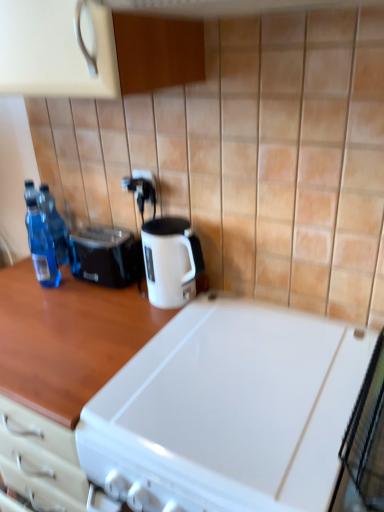
Measure the distance between white glossy electric kettle at center and camera.

A distance of 1.13 meters exists between white glossy electric kettle at center and camera.

The width and height of the screenshot is (384, 512). What do you see at coordinates (55, 225) in the screenshot? I see `transparent plastic bottles at left, marked as the second bottle in a front-to-back arrangement` at bounding box center [55, 225].

Measure the distance between point (51, 264) and camera.

Point (51, 264) and camera are 4.38 feet apart.

The height and width of the screenshot is (512, 384). Describe the element at coordinates (41, 244) in the screenshot. I see `transparent plastic bottles at left, which is the first bottle from front to back` at that location.

How much space does woodenmaterial/texturecountertop at center, marked as the first countertop in a left-to-right arrangement, occupy vertically?

woodenmaterial/texturecountertop at center, marked as the first countertop in a left-to-right arrangement, is 34.20 inches in height.

What is the approximate width of black plastic toaster at left?

black plastic toaster at left is 6.89 inches in width.

Where is `black plastic toaster at left`? black plastic toaster at left is located at coordinates (105, 256).

Where is `white glossy electric kettle at center`? The image size is (384, 512). white glossy electric kettle at center is located at coordinates coord(166,249).

Is transparent plastic bottles at left, marked as the second bottle in a front-to-back arrangement, looking in the opposite direction of white plastic electric outlet at center, the first electric outlet ordered from the bottom?

No, transparent plastic bottles at left, marked as the second bottle in a front-to-back arrangement, is not facing away from white plastic electric outlet at center, the first electric outlet ordered from the bottom.

From a real-world perspective, who is located higher, transparent plastic bottles at left, arranged as the first bottle when viewed from the back, or white plastic electric outlet at center, positioned as the 2th electric outlet in top-to-bottom order?

white plastic electric outlet at center, positioned as the 2th electric outlet in top-to-bottom order, from a real-world perspective.

How distant is transparent plastic bottles at left, marked as the second bottle in a front-to-back arrangement, from white plastic electric outlet at center, positioned as the 2th electric outlet in top-to-bottom order?

A distance of 29.43 centimeters exists between transparent plastic bottles at left, marked as the second bottle in a front-to-back arrangement, and white plastic electric outlet at center, positioned as the 2th electric outlet in top-to-bottom order.

Considering the relative sizes of white plastic electric outlet at center, positioned as the 2th electric outlet in top-to-bottom order, and woodenmaterial/texturecountertop at center, arranged as the 2th countertop when viewed from the right, in the image provided, is white plastic electric outlet at center, positioned as the 2th electric outlet in top-to-bottom order, taller than woodenmaterial/texturecountertop at center, arranged as the 2th countertop when viewed from the right,?

No, white plastic electric outlet at center, positioned as the 2th electric outlet in top-to-bottom order, is not taller than woodenmaterial/texturecountertop at center, arranged as the 2th countertop when viewed from the right.

Can you tell me how much white plastic electric outlet at center, the first electric outlet ordered from the bottom, and woodenmaterial/texturecountertop at center, marked as the first countertop in a left-to-right arrangement, differ in facing direction?

The facing directions of white plastic electric outlet at center, the first electric outlet ordered from the bottom, and woodenmaterial/texturecountertop at center, marked as the first countertop in a left-to-right arrangement, are 0.463 degrees apart.

In the scene shown: In terms of width, does white plastic electric outlet at center, the first electric outlet ordered from the bottom, look wider or thinner when compared to woodenmaterial/texturecountertop at center, arranged as the 2th countertop when viewed from the right?

Considering their sizes, white plastic electric outlet at center, the first electric outlet ordered from the bottom, looks slimmer than woodenmaterial/texturecountertop at center, arranged as the 2th countertop when viewed from the right.

From the image's perspective, is black plastic electric outlet at upper center, which ranks as the 2th electric outlet in bottom-to-top order, positioned above or below white plastic electric outlet at center, the first electric outlet ordered from the bottom?

black plastic electric outlet at upper center, which ranks as the 2th electric outlet in bottom-to-top order, is above white plastic electric outlet at center, the first electric outlet ordered from the bottom.

Would you say black plastic electric outlet at upper center, which ranks as the 2th electric outlet in bottom-to-top order, is to the left or to the right of white plastic electric outlet at center, the first electric outlet ordered from the bottom, in the picture?

From the image, it's evident that black plastic electric outlet at upper center, which ranks as the 2th electric outlet in bottom-to-top order, is to the right of white plastic electric outlet at center, the first electric outlet ordered from the bottom.

Is black plastic electric outlet at upper center, arranged as the first electric outlet when viewed from the top, outside of white plastic electric outlet at center, positioned as the 2th electric outlet in top-to-bottom order?

Indeed, black plastic electric outlet at upper center, arranged as the first electric outlet when viewed from the top, is completely outside white plastic electric outlet at center, positioned as the 2th electric outlet in top-to-bottom order.

Considering the relative sizes of black plastic toaster at left and white glossy electric kettle at center in the image provided, is black plastic toaster at left taller than white glossy electric kettle at center?

No, black plastic toaster at left is not taller than white glossy electric kettle at center.

From a real-world perspective, is black plastic toaster at left physically located above or below white glossy electric kettle at center?

In terms of real-world spatial position, black plastic toaster at left is below white glossy electric kettle at center.

In the scene shown: Considering the positions of objects black plastic toaster at left and white glossy electric kettle at center in the image provided, who is in front, black plastic toaster at left or white glossy electric kettle at center?

white glossy electric kettle at center is closer to the camera.

Is transparent plastic bottles at left, marked as the second bottle in a front-to-back arrangement, closer to camera compared to white glossy electric kettle at center?

No, transparent plastic bottles at left, marked as the second bottle in a front-to-back arrangement, is behind white glossy electric kettle at center.

Is transparent plastic bottles at left, arranged as the first bottle when viewed from the back, positioned with its back to white glossy electric kettle at center?

transparent plastic bottles at left, arranged as the first bottle when viewed from the back, is not turned away from white glossy electric kettle at center.

Is white glossy electric kettle at center inside transparent plastic bottles at left, arranged as the first bottle when viewed from the back?

No, white glossy electric kettle at center is not a part of transparent plastic bottles at left, arranged as the first bottle when viewed from the back.

Based on the photo, who is more distant, white glossy countertop at upper left, marked as the second countertop in a left-to-right arrangement, or woodenmaterial/texturecountertop at center, marked as the first countertop in a left-to-right arrangement?

woodenmaterial/texturecountertop at center, marked as the first countertop in a left-to-right arrangement, is more distant.

Identify the location of countertop in front of the woodenmaterial/texturecountertop at center, arranged as the 2th countertop when viewed from the right. (172, 400).

Does white glossy countertop at upper left, marked as the second countertop in a left-to-right arrangement, have a smaller size compared to woodenmaterial/texturecountertop at center, marked as the first countertop in a left-to-right arrangement?

Yes.

Based on the photo, which object is closer to the camera taking this photo, woodenmaterial/texturecountertop at center, marked as the first countertop in a left-to-right arrangement, or black plastic electric outlet at upper center, arranged as the first electric outlet when viewed from the top?

woodenmaterial/texturecountertop at center, marked as the first countertop in a left-to-right arrangement, is closer to the camera.

Does woodenmaterial/texturecountertop at center, marked as the first countertop in a left-to-right arrangement, have a lesser height compared to black plastic electric outlet at upper center, arranged as the first electric outlet when viewed from the top?

No, woodenmaterial/texturecountertop at center, marked as the first countertop in a left-to-right arrangement, is not shorter than black plastic electric outlet at upper center, arranged as the first electric outlet when viewed from the top.

From the image's perspective, is woodenmaterial/texturecountertop at center, arranged as the 2th countertop when viewed from the right, located above black plastic electric outlet at upper center, arranged as the first electric outlet when viewed from the top?

No.

Would you consider woodenmaterial/texturecountertop at center, arranged as the 2th countertop when viewed from the right, to be distant from black plastic electric outlet at upper center, which ranks as the 2th electric outlet in bottom-to-top order?

They are positioned close to each other.

From a real-world perspective, which bottle is the 2nd one underneath the white plastic electric outlet at center, positioned as the 2th electric outlet in top-to-bottom order? Please provide its 2D coordinates.

[(55, 225)]

From the image's perspective, starting from the woodenmaterial/texturecountertop at center, arranged as the 2th countertop when viewed from the right, which electric outlet is the 1st one above? Please provide its 2D coordinates.

[(140, 190)]

Which object lies nearer to the anchor point black plastic electric outlet at upper center, arranged as the first electric outlet when viewed from the top, woodenmaterial/texturecountertop at center, marked as the first countertop in a left-to-right arrangement, or white glossy countertop at upper left, arranged as the first countertop when viewed from the right?

woodenmaterial/texturecountertop at center, marked as the first countertop in a left-to-right arrangement, lies closer to black plastic electric outlet at upper center, arranged as the first electric outlet when viewed from the top, than the other object.

Consider the image. Which object lies nearer to the anchor point black plastic toaster at left, white plastic electric outlet at center, the first electric outlet ordered from the bottom, or woodenmaterial/texturecountertop at center, arranged as the 2th countertop when viewed from the right?

woodenmaterial/texturecountertop at center, arranged as the 2th countertop when viewed from the right.

Estimate the real-world distances between objects in this image. Which object is closer to black plastic electric outlet at upper center, which ranks as the 2th electric outlet in bottom-to-top order, transparent plastic bottles at left, positioned as the second bottle in back-to-front order, or white glossy countertop at upper left, arranged as the first countertop when viewed from the right?

transparent plastic bottles at left, positioned as the second bottle in back-to-front order.

Estimate the real-world distances between objects in this image. Which object is further from white glossy electric kettle at center, white glossy countertop at upper left, marked as the second countertop in a left-to-right arrangement, or black plastic toaster at left?

white glossy countertop at upper left, marked as the second countertop in a left-to-right arrangement, lies further to white glossy electric kettle at center than the other object.

Estimate the real-world distances between objects in this image. Which object is closer to black plastic toaster at left, transparent plastic bottles at left, arranged as the first bottle when viewed from the back, or transparent plastic bottles at left, which is the first bottle from front to back?

The object closer to black plastic toaster at left is transparent plastic bottles at left, which is the first bottle from front to back.

Based on their spatial positions, is white glossy countertop at upper left, marked as the second countertop in a left-to-right arrangement, or white glossy electric kettle at center further from transparent plastic bottles at left, which is the first bottle from front to back?

white glossy countertop at upper left, marked as the second countertop in a left-to-right arrangement, lies further to transparent plastic bottles at left, which is the first bottle from front to back, than the other object.

Considering their positions, is black plastic electric outlet at upper center, arranged as the first electric outlet when viewed from the top, positioned closer to woodenmaterial/texturecountertop at center, arranged as the 2th countertop when viewed from the right, than black plastic toaster at left?

black plastic toaster at left is closer to woodenmaterial/texturecountertop at center, arranged as the 2th countertop when viewed from the right.

Based on their spatial positions, is transparent plastic bottles at left, positioned as the second bottle in back-to-front order, or white plastic electric outlet at center, the first electric outlet ordered from the bottom, further from woodenmaterial/texturecountertop at center, marked as the first countertop in a left-to-right arrangement?

The object further to woodenmaterial/texturecountertop at center, marked as the first countertop in a left-to-right arrangement, is white plastic electric outlet at center, the first electric outlet ordered from the bottom.

You are a GUI agent. You are given a task and a screenshot of the screen. Output one action in this format:
    pyautogui.click(x=<x>, y=<y>)
    Task: Click on the coffee machine between transparent plastic bottles at left, positioned as the second bottle in back-to-front order, and woodenmaterial/texturecountertop at center, marked as the first countertop in a left-to-right arrangement, vertically
    This screenshot has height=512, width=384.
    Given the screenshot: What is the action you would take?
    pyautogui.click(x=166, y=249)

Locate an element on the screen. The image size is (384, 512). countertop that lies between white plastic electric outlet at center, positioned as the 2th electric outlet in top-to-bottom order, and woodenmaterial/texturecountertop at center, marked as the first countertop in a left-to-right arrangement, from top to bottom is located at coordinates (172, 400).

At what (x,y) coordinates should I click in order to perform the action: click on electric outlet between black plastic electric outlet at upper center, which ranks as the 2th electric outlet in bottom-to-top order, and woodenmaterial/texturecountertop at center, marked as the first countertop in a left-to-right arrangement, in the up-down direction. Please return your answer as a coordinate pair (x, y). The image size is (384, 512). Looking at the image, I should click on (140, 190).

Find the location of `electric outlet between white glossy countertop at upper left, marked as the second countertop in a left-to-right arrangement, and transparent plastic bottles at left, which is the first bottle from front to back, from front to back`. electric outlet between white glossy countertop at upper left, marked as the second countertop in a left-to-right arrangement, and transparent plastic bottles at left, which is the first bottle from front to back, from front to back is located at coordinates (140, 190).